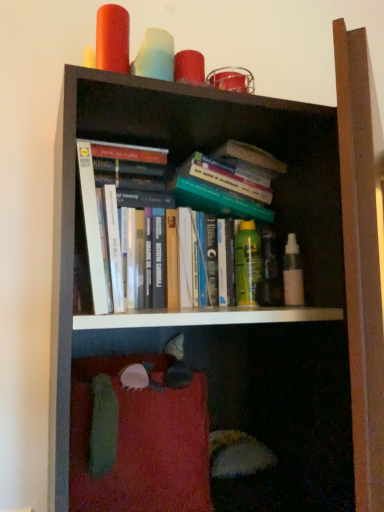
Question: From a real-world perspective, relative to white paperbacks at center, is green matte spray can at center, arranged as the first toiletry when viewed from the back, vertically above or below?

Choices:
 (A) below
 (B) above

Answer: (A)

Question: Is green matte spray can at center, arranged as the first toiletry when viewed from the back, inside or outside of white paperbacks at center?

Choices:
 (A) inside
 (B) outside

Answer: (B)

Question: Based on their relative distances, which object is nearer to the green matte spray can at center, arranged as the first toiletry when viewed from the back?

Choices:
 (A) white matte spray bottle at center right, acting as the 1th toiletry starting from the right
 (B) white paperbacks at center

Answer: (A)

Question: Estimate the real-world distances between objects in this image. Which object is farther from the white matte spray bottle at center right, acting as the 1th toiletry starting from the right?

Choices:
 (A) green matte spray can at center, arranged as the first toiletry when viewed from the back
 (B) white paperbacks at center

Answer: (B)